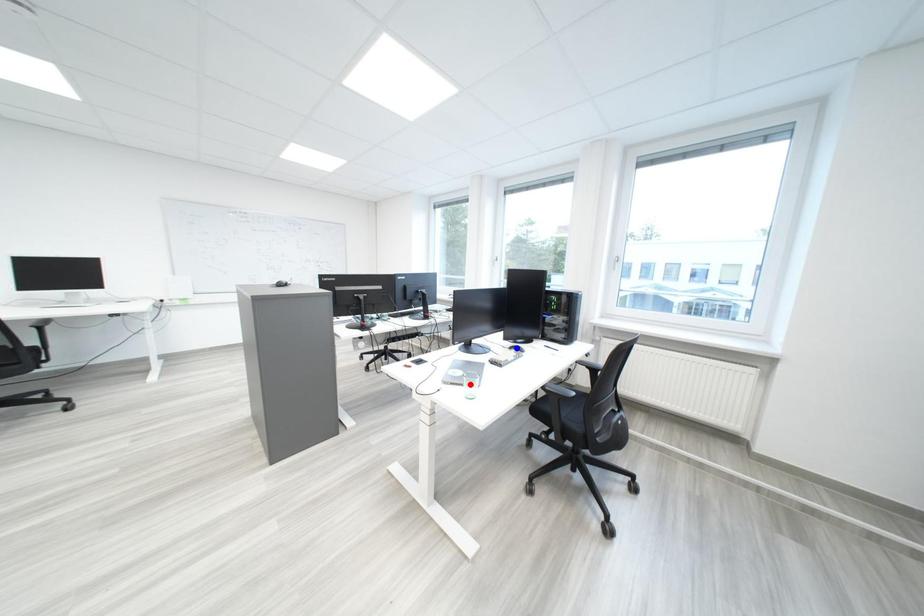
Question: Two points are marked on the image. Which point is closer to the camera?

Choices:
 (A) Blue point is closer.
 (B) Red point is closer.

Answer: (B)